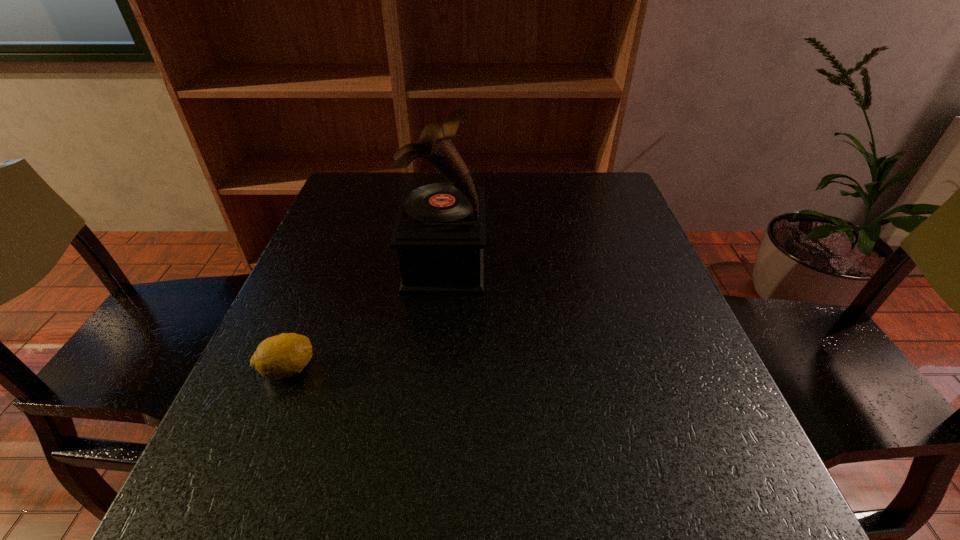
You are a GUI agent. You are given a task and a screenshot of the screen. Output one action in this format:
    pyautogui.click(x=<x>, y=<y>)
    Task: Click on the free spot at the far left corner of the desktop
    Image resolution: width=960 pixels, height=540 pixels.
    Given the screenshot: What is the action you would take?
    pyautogui.click(x=376, y=205)

Image resolution: width=960 pixels, height=540 pixels. Find the location of `vacant position at the far right corner of the desktop`. vacant position at the far right corner of the desktop is located at coordinates (579, 195).

This screenshot has height=540, width=960. In the image, there is a desktop. Identify the location of vacant area at the near right corner. (744, 479).